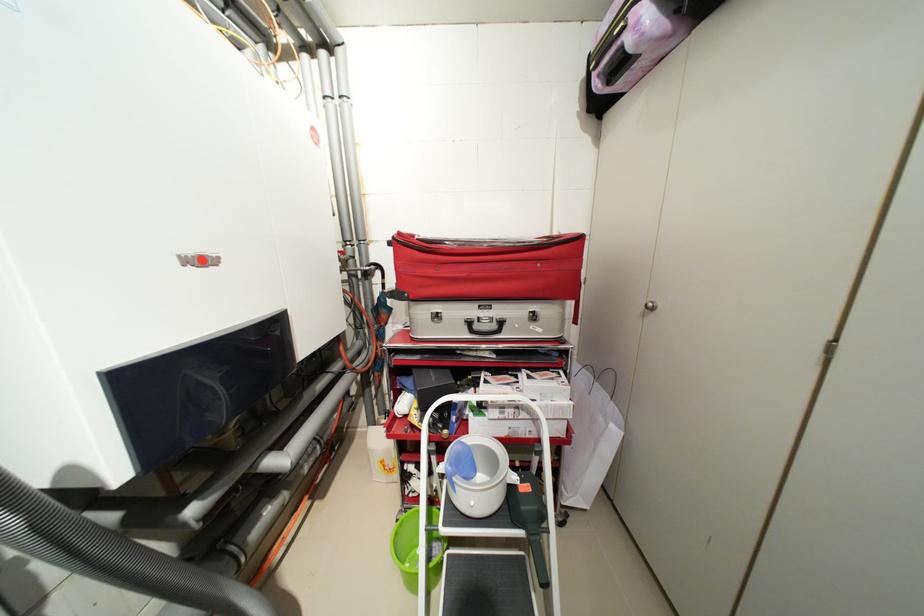
Find the location of a particular element. black suitcase handle is located at coordinates pos(489,267).